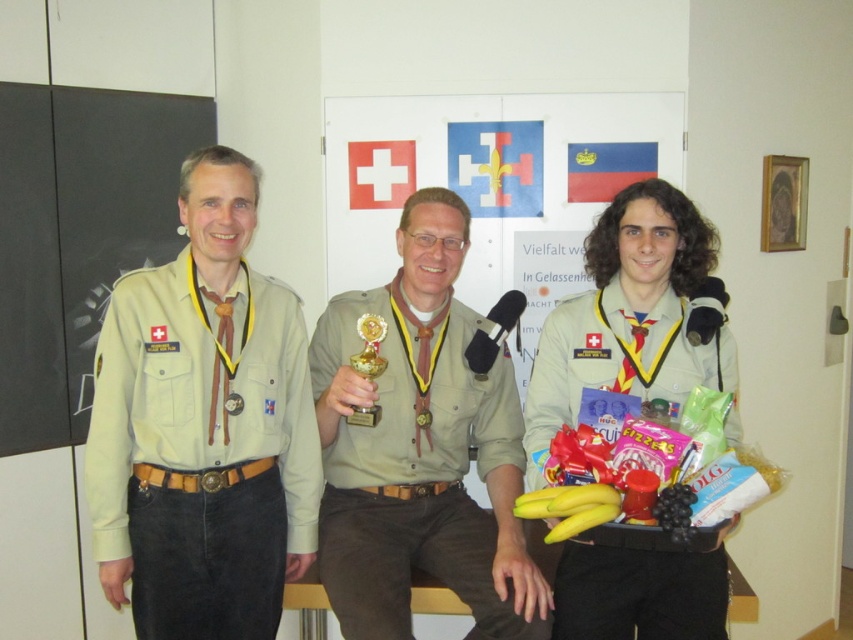
Question: Which point appears farthest from the camera in this image?

Choices:
 (A) (595, 637)
 (B) (119, 483)
 (C) (381, 422)
 (D) (32, 204)

Answer: (D)

Question: Considering the real-world distances, which object is farthest from the gold metallic trophy at center?

Choices:
 (A) matte khaki shirt at center
 (B) beige uniform at left
 (C) khaki uniform at center

Answer: (C)

Question: Can you confirm if beige uniform at left is positioned above khaki uniform at center?

Choices:
 (A) yes
 (B) no

Answer: (A)

Question: Which of the following is the farthest from the observer?

Choices:
 (A) khaki uniform at center
 (B) matte khaki shirt at center
 (C) gold metallic trophy at center

Answer: (C)

Question: Does matte black bulletin board at left appear under gold metallic trophy at center?

Choices:
 (A) no
 (B) yes

Answer: (A)

Question: In this image, where is matte black bulletin board at left located relative to khaki uniform at center?

Choices:
 (A) above
 (B) below

Answer: (A)